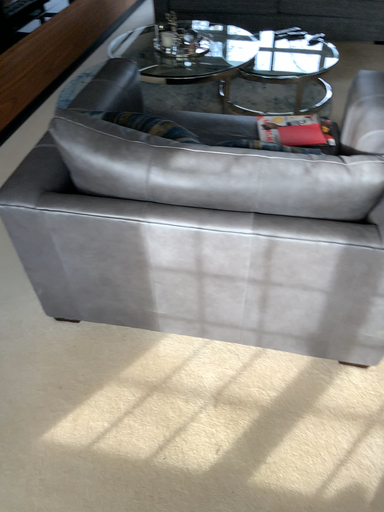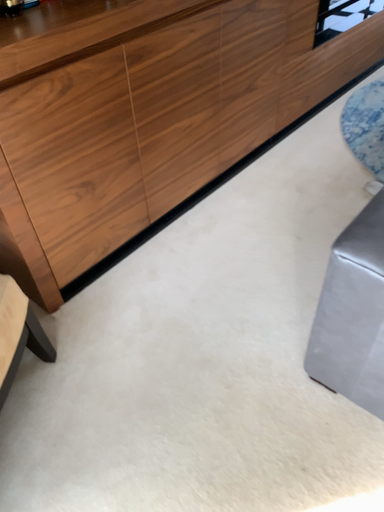
Question: Which way did the camera rotate in the video?

Choices:
 (A) rotated left
 (B) rotated right

Answer: (A)